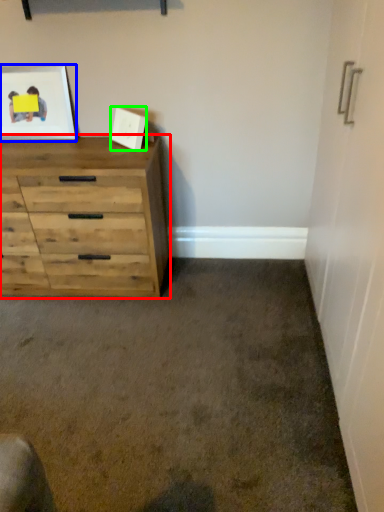
Question: Based on their relative distances, which object is farther from chest of drawers (highlighted by a red box)? Choose from picture frame (highlighted by a blue box) and picture frame (highlighted by a green box).

Choices:
 (A) picture frame
 (B) picture frame

Answer: (B)